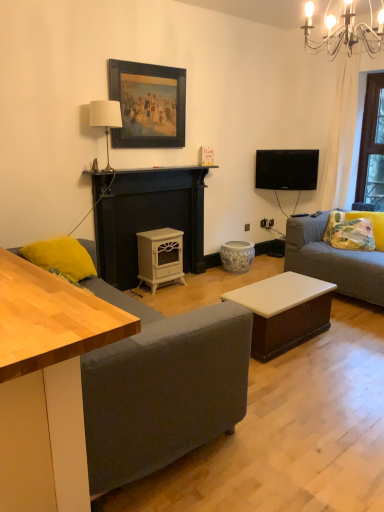
At what (x,y) coordinates should I click in order to perform the action: click on vacant space in front of white glossy wood stove at center. Please return your answer as a coordinate pair (x, y). Looking at the image, I should click on (172, 295).